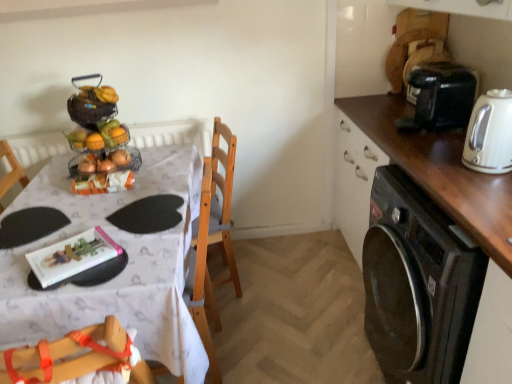
Where is `vacant space to the right of wooden chair at center, the second chair viewed from the front`? This screenshot has width=512, height=384. vacant space to the right of wooden chair at center, the second chair viewed from the front is located at coordinates (275, 278).